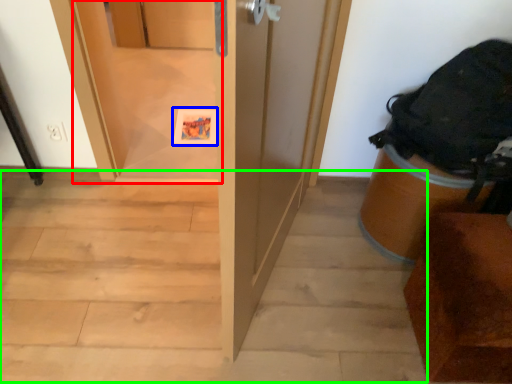
Question: Estimate the real-world distances between objects in this image. Which object is farther from screen door (highlighted by a red box), postcard (highlighted by a blue box) or stairwell (highlighted by a green box)?

Choices:
 (A) postcard
 (B) stairwell

Answer: (B)